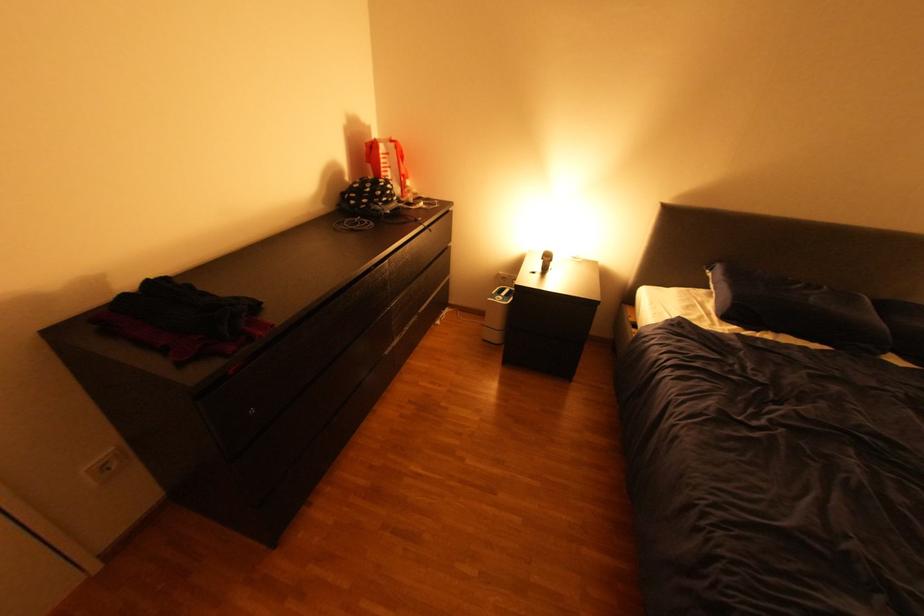
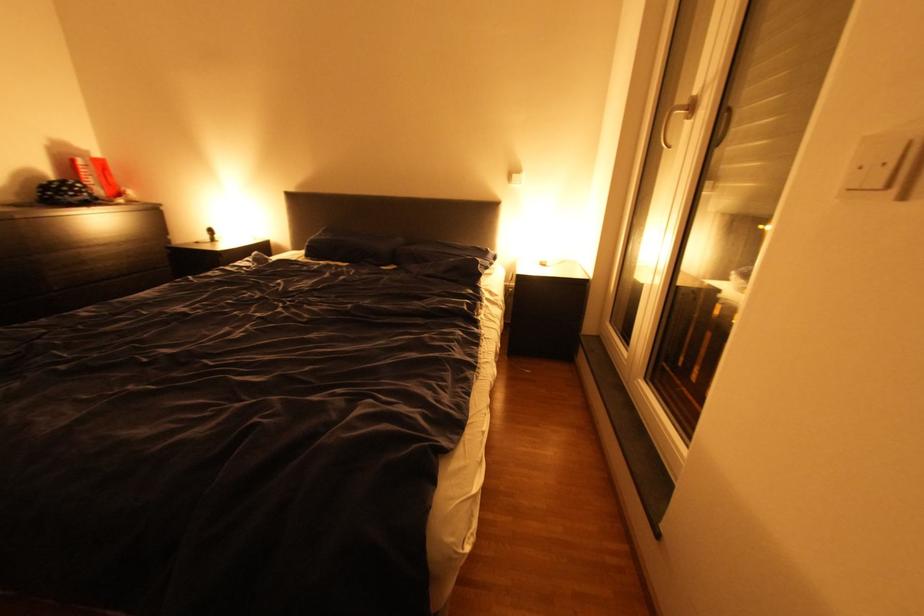
The images are taken continuously from a first-person perspective. In which direction are you moving?

The cameraman walked toward right, backward.